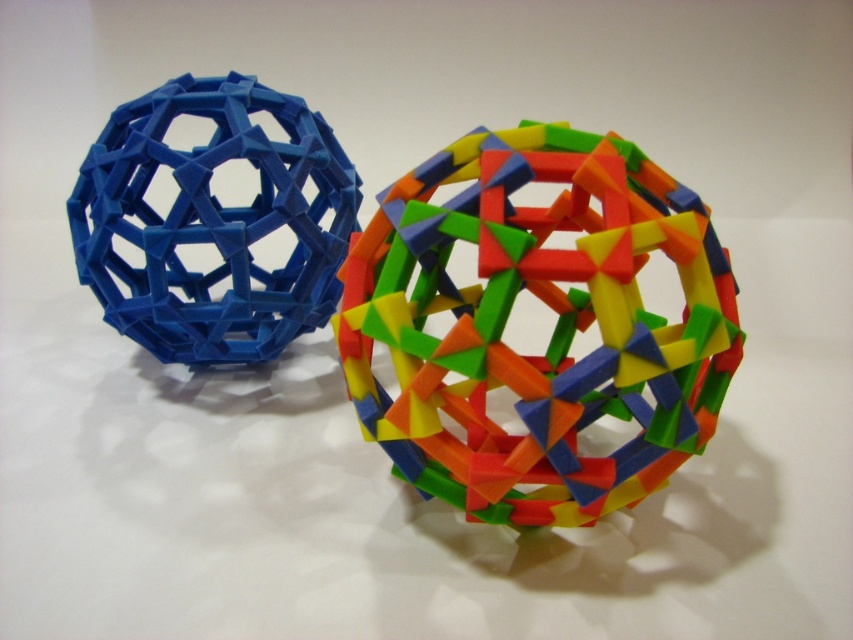
Question: Does multicolored plastic geometric ball at center appear on the left side of matte blue plastic sphere at left?

Choices:
 (A) yes
 (B) no

Answer: (B)

Question: Among these objects, which one is farthest from the camera?

Choices:
 (A) multicolored plastic geometric ball at center
 (B) matte blue plastic sphere at left

Answer: (B)

Question: Does multicolored plastic geometric ball at center appear under matte blue plastic sphere at left?

Choices:
 (A) yes
 (B) no

Answer: (A)

Question: Which point is closer to the camera?

Choices:
 (A) multicolored plastic geometric ball at center
 (B) matte blue plastic sphere at left

Answer: (A)

Question: Does multicolored plastic geometric ball at center appear under matte blue plastic sphere at left?

Choices:
 (A) yes
 (B) no

Answer: (A)